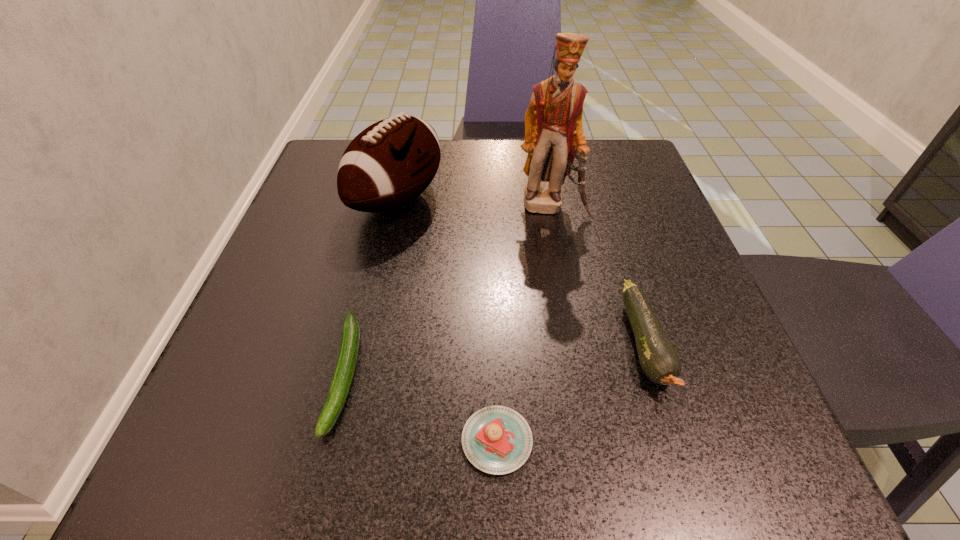
The image size is (960, 540). In order to click on nutcracker in this screenshot , I will do `click(554, 137)`.

Find the location of a particular element. the tallest object is located at coordinates (554, 137).

Locate an element on the screen. The image size is (960, 540). the fourth shortest object is located at coordinates (390, 163).

At what (x,y) coordinates should I click in order to perform the action: click on the third tallest object. Please return your answer as a coordinate pair (x, y). Looking at the image, I should click on (659, 360).

You are a GUI agent. You are given a task and a screenshot of the screen. Output one action in this format:
    pyautogui.click(x=<x>, y=<y>)
    Task: Click on the taller zucchini
    The width and height of the screenshot is (960, 540).
    Given the screenshot: What is the action you would take?
    pyautogui.click(x=659, y=360)

At what (x,y) coordinates should I click in order to perform the action: click on the left zucchini. Please return your answer as a coordinate pair (x, y). Looking at the image, I should click on click(348, 353).

The height and width of the screenshot is (540, 960). What are the coordinates of `the third object from left to right` in the screenshot? It's located at (497, 440).

At what (x,y) coordinates should I click in order to perform the action: click on free region located on the front-facing side of the tallest object. Please return your answer as a coordinate pair (x, y). The width and height of the screenshot is (960, 540). Looking at the image, I should click on (587, 393).

Image resolution: width=960 pixels, height=540 pixels. Find the location of `vacant position located 0.280m on the front of the second tallest object`. vacant position located 0.280m on the front of the second tallest object is located at coordinates (361, 368).

This screenshot has width=960, height=540. I want to click on vacant space located on the front-facing side of the shorter zucchini, so click(x=318, y=484).